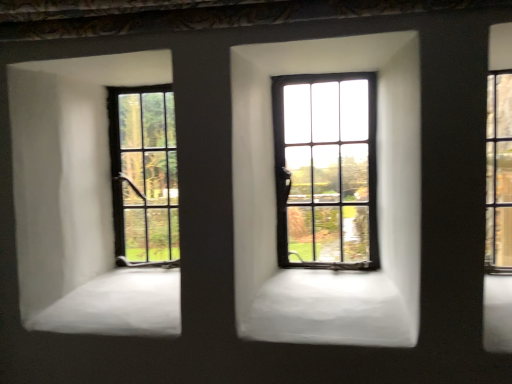
Question: From a real-world perspective, is matte black window at center, which appears as the second window when viewed from the right, positioned above or below matte black window at left, the first window when ordered from left to right?

Choices:
 (A) below
 (B) above

Answer: (B)

Question: Looking at their shapes, would you say matte black window at center, the 2th window viewed from the left, is wider or thinner than matte black window at left, the first window when ordered from left to right?

Choices:
 (A) thin
 (B) wide

Answer: (B)

Question: Which is farther from the matte black window at left, the first window when ordered from left to right?

Choices:
 (A) clear glass window at right, acting as the third window starting from the left
 (B) matte black window at center, the 2th window viewed from the left

Answer: (A)

Question: Which is nearer to the matte black window at center, the 2th window viewed from the left?

Choices:
 (A) clear glass window at right, which appears as the first window when viewed from the right
 (B) matte black window at left, the first window when ordered from left to right

Answer: (B)